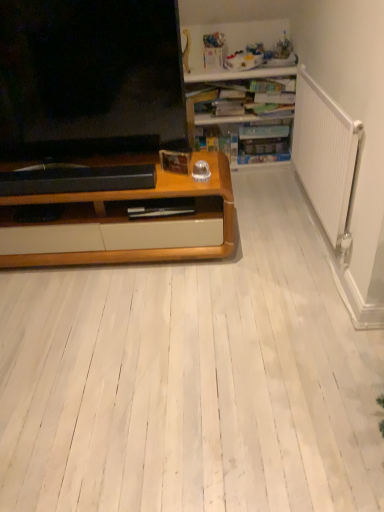
Question: From the image's perspective, is wooden desk at upper right located beneath matte black television at left?

Choices:
 (A) no
 (B) yes

Answer: (A)

Question: Is wooden desk at upper right taller than matte black television at left?

Choices:
 (A) no
 (B) yes

Answer: (A)

Question: Could you tell me if wooden desk at upper right is facing matte black television at left?

Choices:
 (A) no
 (B) yes

Answer: (A)

Question: Does wooden desk at upper right come behind matte black television at left?

Choices:
 (A) no
 (B) yes

Answer: (B)

Question: From the image's perspective, is wooden desk at upper right on matte black television at left?

Choices:
 (A) yes
 (B) no

Answer: (A)

Question: Is wooden desk at upper right facing away from matte black television at left?

Choices:
 (A) no
 (B) yes

Answer: (A)

Question: From the image's perspective, would you say matte black television at left is shown under wooden desk at upper right?

Choices:
 (A) no
 (B) yes

Answer: (B)

Question: Considering the relative positions of matte black television at left and wooden desk at upper right in the image provided, is matte black television at left to the right of wooden desk at upper right from the viewer's perspective?

Choices:
 (A) no
 (B) yes

Answer: (A)

Question: Can you confirm if matte black television at left is smaller than wooden desk at upper right?

Choices:
 (A) yes
 (B) no

Answer: (A)

Question: From the image's perspective, is matte black television at left on wooden desk at upper right?

Choices:
 (A) no
 (B) yes

Answer: (A)

Question: Is matte black television at left closer to the viewer compared to wooden desk at upper right?

Choices:
 (A) yes
 (B) no

Answer: (A)

Question: Is matte black television at left at the left side of wooden desk at upper right?

Choices:
 (A) yes
 (B) no

Answer: (A)

Question: Does point (278, 119) appear closer or farther from the camera than point (1, 24)?

Choices:
 (A) farther
 (B) closer

Answer: (A)